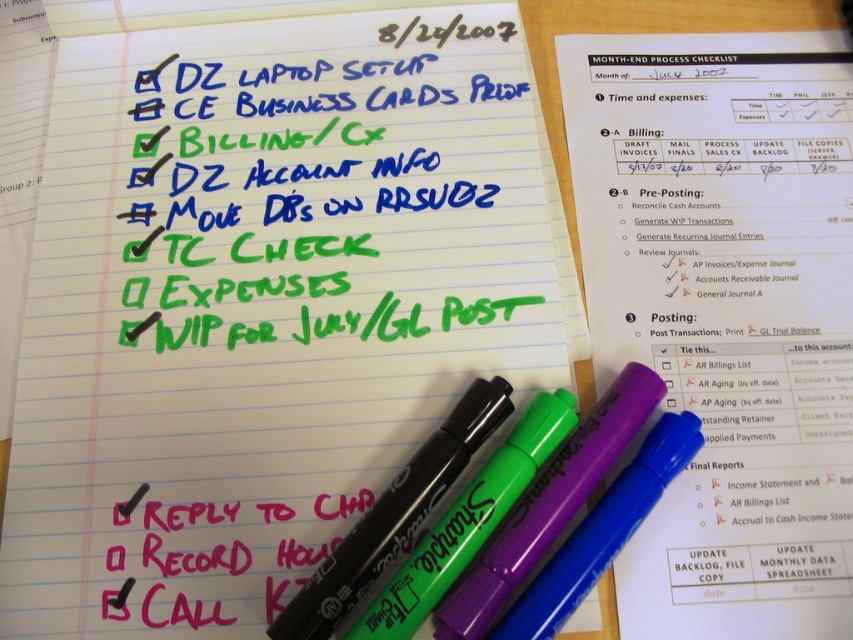
Question: Estimate the real-world distances between objects in this image. Which object is closer to the black smoothie marker at center?

Choices:
 (A) white paper at upper center
 (B) green marker at center

Answer: (B)

Question: Is white paper at upper center to the left of black smoothie marker at center from the viewer's perspective?

Choices:
 (A) yes
 (B) no

Answer: (B)

Question: Does white lined paper at center have a larger size compared to black smoothie marker at center?

Choices:
 (A) yes
 (B) no

Answer: (A)

Question: Does white paper at upper center appear on the right side of green marker at center?

Choices:
 (A) no
 (B) yes

Answer: (B)

Question: Which point appears farthest from the camera in this image?

Choices:
 (A) [x=263, y=579]
 (B) [x=479, y=438]
 (C) [x=746, y=244]

Answer: (C)

Question: Based on their relative distances, which object is nearer to the white lined paper at center?

Choices:
 (A) green marker at center
 (B) black smoothie marker at center

Answer: (B)